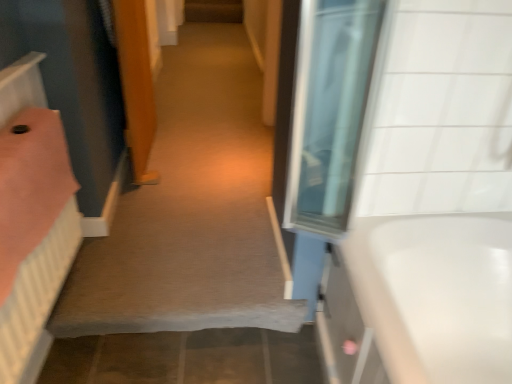
Question: Can you see white glossy bathtub at right touching pink fabric bed at left?

Choices:
 (A) yes
 (B) no

Answer: (B)

Question: Considering the relative sizes of white glossy bathtub at right and pink fabric bed at left in the image provided, is white glossy bathtub at right wider than pink fabric bed at left?

Choices:
 (A) yes
 (B) no

Answer: (A)

Question: Considering the relative sizes of white glossy bathtub at right and pink fabric bed at left in the image provided, is white glossy bathtub at right smaller than pink fabric bed at left?

Choices:
 (A) yes
 (B) no

Answer: (B)

Question: Is white glossy bathtub at right surrounding pink fabric bed at left?

Choices:
 (A) no
 (B) yes

Answer: (A)

Question: From the image's perspective, would you say white glossy bathtub at right is positioned over pink fabric bed at left?

Choices:
 (A) no
 (B) yes

Answer: (A)

Question: Considering the relative positions of white glossy bathtub at right and pink fabric bed at left in the image provided, is white glossy bathtub at right in front of pink fabric bed at left?

Choices:
 (A) no
 (B) yes

Answer: (A)

Question: Is wooden door at center behind carpet at center?

Choices:
 (A) no
 (B) yes

Answer: (B)

Question: Is wooden door at center surrounding carpet at center?

Choices:
 (A) no
 (B) yes

Answer: (A)

Question: Are wooden door at center and carpet at center beside each other?

Choices:
 (A) yes
 (B) no

Answer: (B)

Question: Can you confirm if wooden door at center is bigger than carpet at center?

Choices:
 (A) no
 (B) yes

Answer: (B)

Question: Can you confirm if wooden door at center is wider than carpet at center?

Choices:
 (A) yes
 (B) no

Answer: (B)

Question: From a real-world perspective, is wooden door at center positioned under carpet at center based on gravity?

Choices:
 (A) no
 (B) yes

Answer: (A)

Question: Is pink fabric bed at left closer to camera compared to carpet at center?

Choices:
 (A) no
 (B) yes

Answer: (B)